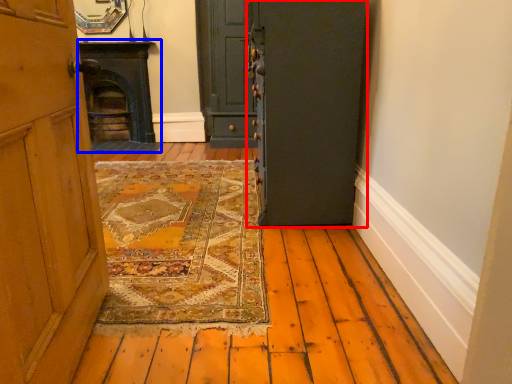
Question: Among these objects, which one is nearest to the camera, door (highlighted by a red box) or fireplace (highlighted by a blue box)?

Choices:
 (A) door
 (B) fireplace

Answer: (A)